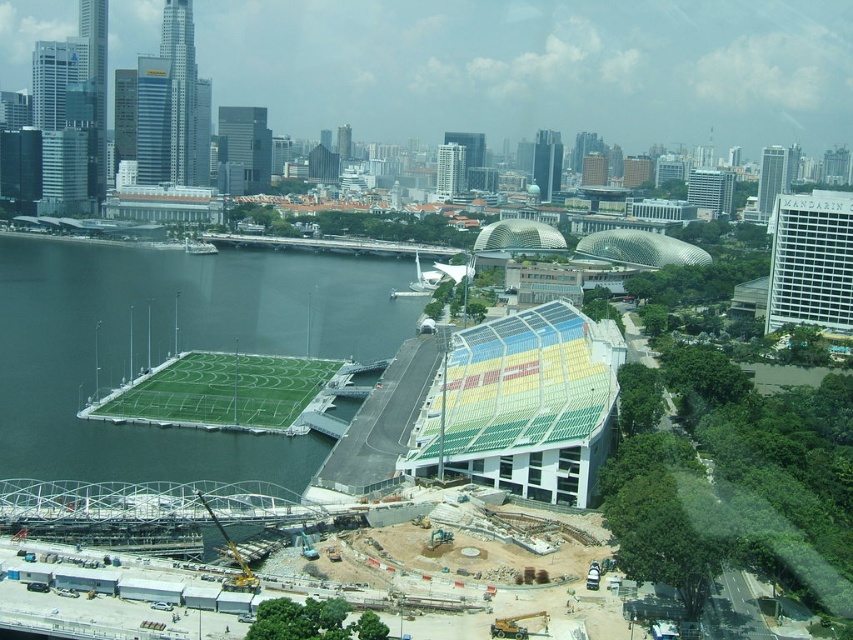
Question: Considering the relative positions of green artificial turf at left and green artificial turf at lower left in the image provided, where is green artificial turf at left located with respect to green artificial turf at lower left?

Choices:
 (A) below
 (B) above

Answer: (B)

Question: Is green artificial turf at left further to the viewer compared to green artificial turf at lower left?

Choices:
 (A) no
 (B) yes

Answer: (A)

Question: Which of the following is the farthest from the observer?

Choices:
 (A) (283, 429)
 (B) (281, 337)

Answer: (B)

Question: Is green artificial turf at left below green artificial turf at lower left?

Choices:
 (A) no
 (B) yes

Answer: (A)

Question: Which point is closer to the camera taking this photo?

Choices:
 (A) (189, 326)
 (B) (321, 387)

Answer: (B)